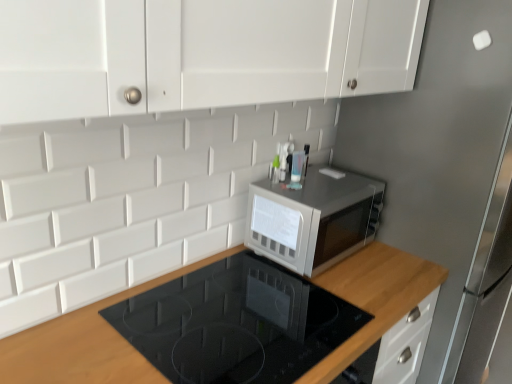
Question: From a real-world perspective, is wooden at upper right on satin silver fridge at upper right?

Choices:
 (A) yes
 (B) no

Answer: (B)

Question: Does wooden at upper right have a lesser height compared to satin silver fridge at upper right?

Choices:
 (A) yes
 (B) no

Answer: (A)

Question: Is the position of wooden at upper right more distant than that of satin silver fridge at upper right?

Choices:
 (A) no
 (B) yes

Answer: (A)

Question: Does wooden at upper right have a lesser width compared to satin silver fridge at upper right?

Choices:
 (A) no
 (B) yes

Answer: (B)

Question: Considering the relative sizes of wooden at upper right and satin silver fridge at upper right in the image provided, is wooden at upper right wider than satin silver fridge at upper right?

Choices:
 (A) yes
 (B) no

Answer: (B)

Question: Are wooden at upper right and satin silver fridge at upper right beside each other?

Choices:
 (A) yes
 (B) no

Answer: (B)

Question: Can we say satin silver fridge at upper right lies outside satin silver microwave at center?

Choices:
 (A) no
 (B) yes

Answer: (B)

Question: Can you confirm if satin silver fridge at upper right is taller than satin silver microwave at center?

Choices:
 (A) no
 (B) yes

Answer: (B)

Question: Can you confirm if satin silver fridge at upper right is shorter than satin silver microwave at center?

Choices:
 (A) no
 (B) yes

Answer: (A)

Question: Is satin silver fridge at upper right closer to the viewer compared to satin silver microwave at center?

Choices:
 (A) no
 (B) yes

Answer: (B)

Question: Is satin silver microwave at center completely or partially inside satin silver fridge at upper right?

Choices:
 (A) no
 (B) yes

Answer: (A)

Question: Is satin silver microwave at center at the back of satin silver fridge at upper right?

Choices:
 (A) no
 (B) yes

Answer: (A)

Question: Can you confirm if wooden at upper right is taller than satin silver microwave at center?

Choices:
 (A) no
 (B) yes

Answer: (B)